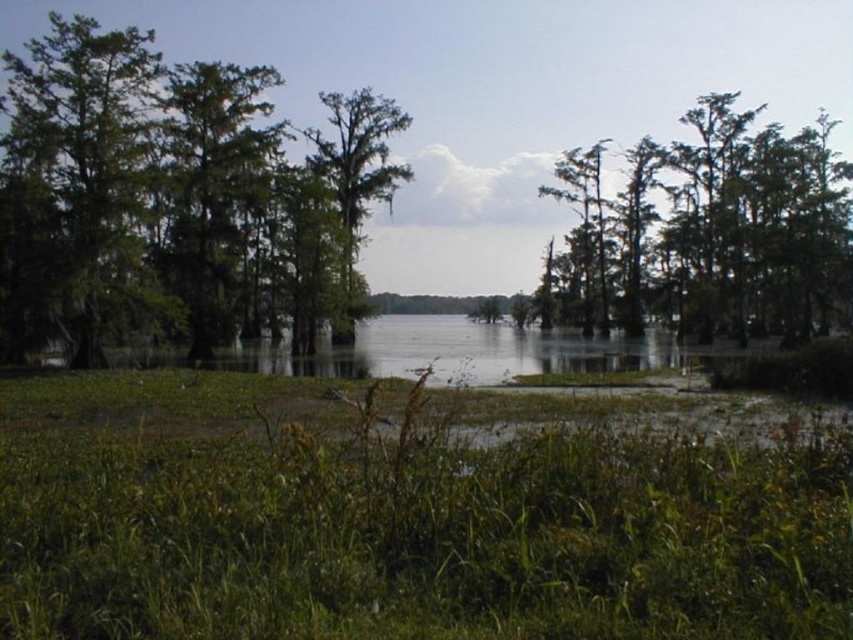
You are a bird flying over the wetland and want to land on the tallest green mossy trees. Which one should you choose between the green mossy trees at left and the green mossy trees at right?

The green mossy trees at left is taller than the green mossy trees at right, so you should choose the green mossy trees at left to land on.

You are a bird flying over the wetland scene. You see the green mossy trees at right and the green mossy tree at left. Which tree would you land on if you want to perch on the taller one?

The green mossy tree at left is taller than the green mossy trees at right, so you should land on the green mossy tree at left.

You are standing in the wetland scene and want to take a photo of the green mossy tree at left. If your camera can focus on objects up to 30 meters away, will it be able to capture the tree clearly?

The green mossy tree at left is 32.82 meters from viewer, which is beyond the camera focus range of 30 meters. The camera cannot capture the tree clearly.